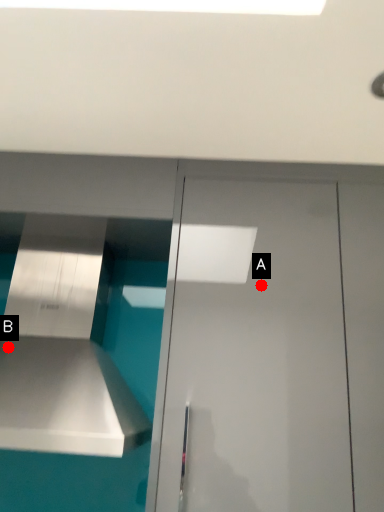
Question: Two points are circled on the image, labeled by A and B beside each circle. Which point appears farthest from the camera in this image?

Choices:
 (A) A is further
 (B) B is further

Answer: (B)